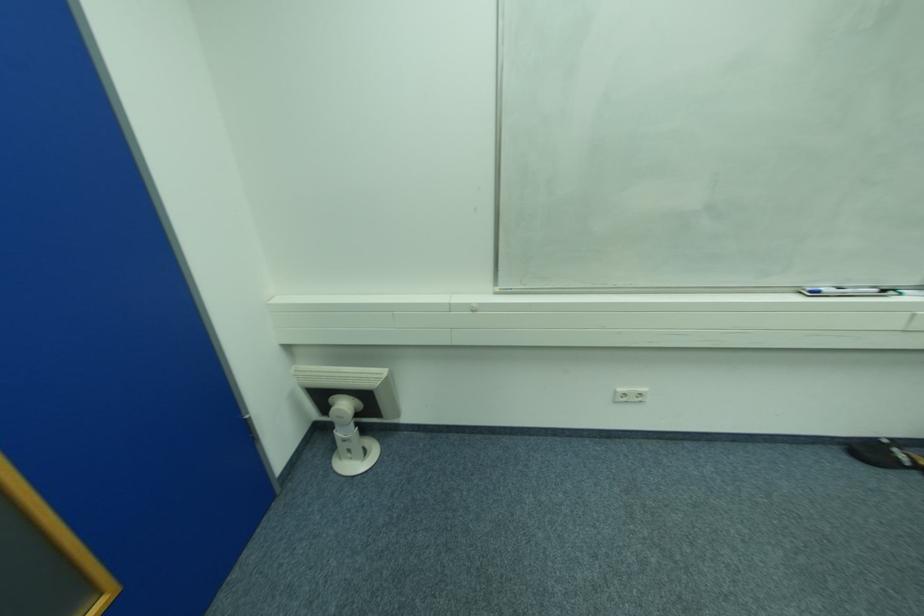
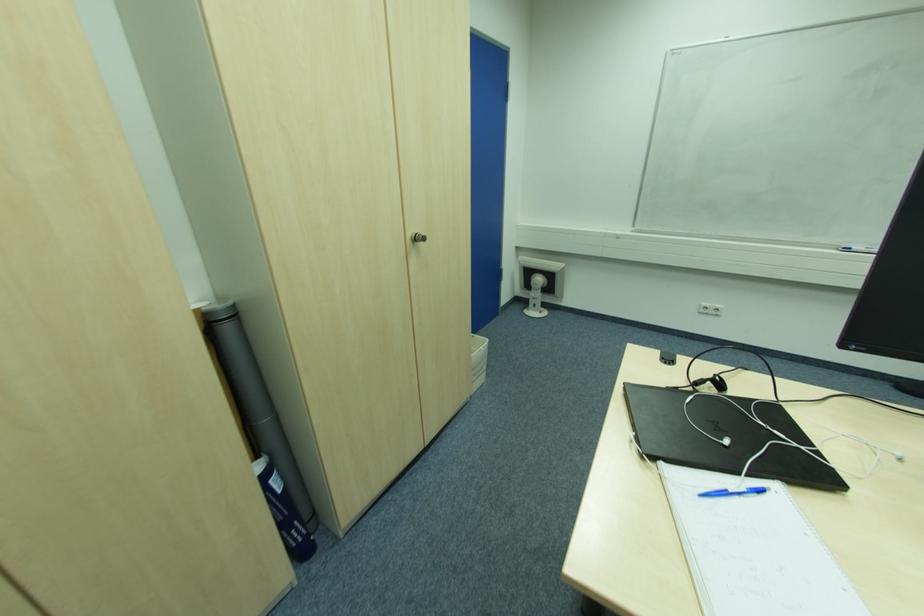
Question: Which direction would the cameraman need to move to produce the second image? Reply with the corresponding letter.

Choices:
 (A) Left
 (B) Right
 (C) Forward
 (D) Backward

Answer: (D)